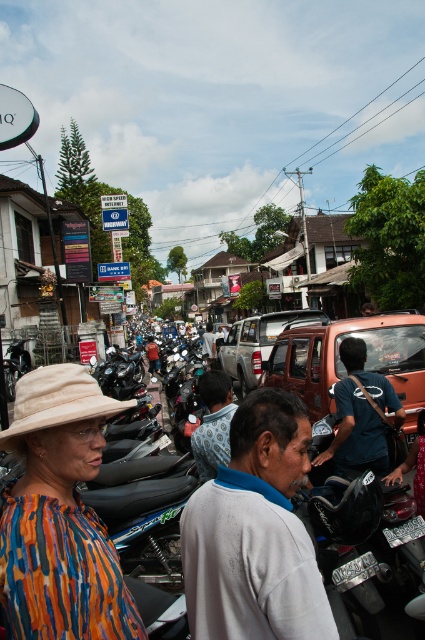
Can you confirm if metallic silver motorcycle at center is taller than multicolored striped shirt at center?

Incorrect, metallic silver motorcycle at center's height is not larger of multicolored striped shirt at center's.

Is point (90, 554) in front of point (53, 572)?

No, (90, 554) is further to viewer.

The image size is (425, 640). I want to click on metallic silver motorcycle at center, so click(x=61, y=515).

Can you confirm if gray cotton shirt at center is positioned to the left of blue denim shirt at center?

In fact, gray cotton shirt at center is to the right of blue denim shirt at center.

Does gray cotton shirt at center have a greater width compared to blue denim shirt at center?

No, gray cotton shirt at center is not wider than blue denim shirt at center.

Where is `gray cotton shirt at center`? This screenshot has height=640, width=425. gray cotton shirt at center is located at coordinates (255, 532).

What are the coordinates of `gray cotton shirt at center` in the screenshot? It's located at (255, 532).

Which is more to the right, metallic silver motorcycle at center or orange matte truck at center?

Positioned to the right is orange matte truck at center.

Is point (57, 525) positioned in front of point (345, 321)?

That is True.

Locate an element on the screen. The height and width of the screenshot is (640, 425). metallic silver motorcycle at center is located at coordinates (61, 515).